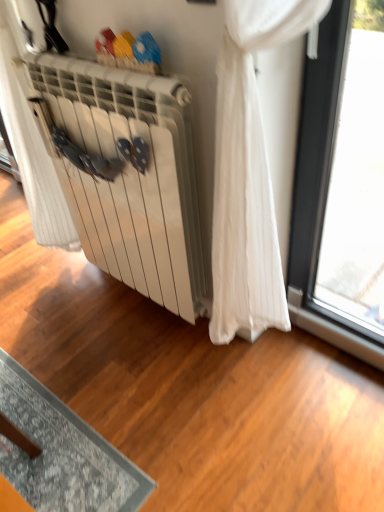
This screenshot has width=384, height=512. What do you see at coordinates (31, 146) in the screenshot?
I see `white sheer curtain at center` at bounding box center [31, 146].

Locate an element on the screen. The image size is (384, 512). white sheer curtain at center is located at coordinates (31, 146).

What is the approximate width of white sheer curtain at center?

It is 9.06 inches.

Consider the image. What is the approximate height of white matte radiator at center?

It is 90.83 centimeters.

What is the approximate width of white matte radiator at center?

white matte radiator at center is 5.06 inches wide.

You are a GUI agent. You are given a task and a screenshot of the screen. Output one action in this format:
    pyautogui.click(x=<x>, y=<y>)
    Task: Click on the white matte radiator at center
    Image resolution: width=384 pixels, height=512 pixels.
    Given the screenshot: What is the action you would take?
    pyautogui.click(x=129, y=176)

What do you see at coordinates (129, 176) in the screenshot?
I see `white matte radiator at center` at bounding box center [129, 176].

At what (x,y) coordinates should I click in order to perform the action: click on white sheer curtain at center. Please return your answer as a coordinate pair (x, y). The height and width of the screenshot is (512, 384). Looking at the image, I should click on (31, 146).

Which is more to the right, white sheer curtain at center or white matte radiator at center?

From the viewer's perspective, white matte radiator at center appears more on the right side.

Which object is closer to the camera, white sheer curtain at center or white matte radiator at center?

white matte radiator at center is more forward.

Which is farther, (68, 228) or (159, 298)?

The point (68, 228) is more distant.

From the image's perspective, between white sheer curtain at center and white matte radiator at center, who is located below?

white matte radiator at center appears lower in the image.

From a real-world perspective, is white sheer curtain at center positioned above or below white matte radiator at center?

In terms of real-world spatial position, white sheer curtain at center is above white matte radiator at center.

Is white sheer curtain at center wider or thinner than white matte radiator at center?

In the image, white sheer curtain at center appears to be wider than white matte radiator at center.

Between white sheer curtain at center and white matte radiator at center, which one has less height?

With less height is white matte radiator at center.

Who is bigger, white sheer curtain at center or white matte radiator at center?

With larger size is white sheer curtain at center.

Is white sheer curtain at center outside of white matte radiator at center?

Absolutely, white sheer curtain at center is external to white matte radiator at center.

Would you consider white sheer curtain at center to be distant from white matte radiator at center?

Actually, white sheer curtain at center and white matte radiator at center are a little close together.

Is white sheer curtain at center positioned with its back to white matte radiator at center?

No.

Find the location of a particular element. This screenshot has height=512, width=384. curtain above the white matte radiator at center (from the image's perspective) is located at coordinates point(31,146).

Is white matte radiator at center to the left of white sheer curtain at center from the viewer's perspective?

In fact, white matte radiator at center is to the right of white sheer curtain at center.

Based on the photo, which object is closer to the camera taking this photo, white matte radiator at center or white sheer curtain at center?

white matte radiator at center.

Is point (141, 101) positioned after point (26, 139)?

No, it is not.

From the image's perspective, is white matte radiator at center on white sheer curtain at center?

Actually, white matte radiator at center appears below white sheer curtain at center in the image.

From a real-world perspective, which is physically below, white matte radiator at center or white sheer curtain at center?

From a 3D spatial view, white matte radiator at center is below.

Is white matte radiator at center thinner than white sheer curtain at center?

Yes.

Does white matte radiator at center have a greater height compared to white sheer curtain at center?

No, white matte radiator at center is not taller than white sheer curtain at center.

Which of these two, white matte radiator at center or white sheer curtain at center, is smaller?

With smaller size is white matte radiator at center.

Is white matte radiator at center completely or partially outside of white sheer curtain at center?

Yes, white matte radiator at center is located beyond the bounds of white sheer curtain at center.

Is white matte radiator at center touching white sheer curtain at center?

No, white matte radiator at center is not with white sheer curtain at center.

Is white matte radiator at center aimed at white sheer curtain at center?

No, white matte radiator at center is not oriented towards white sheer curtain at center.

How different are the orientations of white matte radiator at center and white sheer curtain at center in degrees?

The angular difference between white matte radiator at center and white sheer curtain at center is 3.04 degrees.

Where is `radiator below the white sheer curtain at center (from the image's perspective)`? The image size is (384, 512). radiator below the white sheer curtain at center (from the image's perspective) is located at coordinates (129, 176).

Find the location of a particular element. curtain that appears above the white matte radiator at center (from the image's perspective) is located at coordinates (31, 146).

I want to click on curtain above the white matte radiator at center (from a real-world perspective), so click(31, 146).